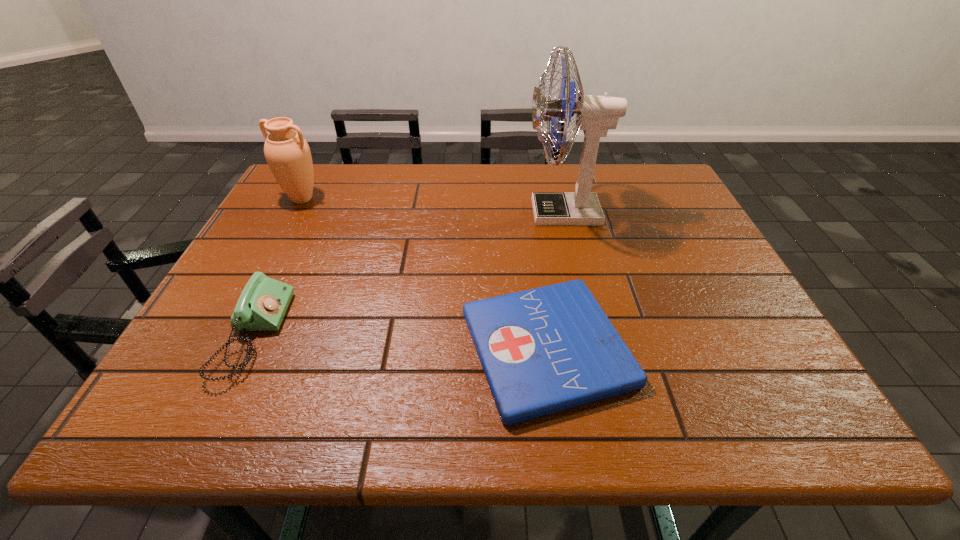
Find the location of a particular element. The image size is (960, 540). vacant space that satisfies the following two spatial constraints: 1. on the front side of the first-aid kit; 2. on the left side of the second tallest object is located at coordinates (223, 348).

Where is `vacant space that satisfies the following two spatial constraints: 1. on the dial of the telephone; 2. on the right side of the shortest object`? The width and height of the screenshot is (960, 540). vacant space that satisfies the following two spatial constraints: 1. on the dial of the telephone; 2. on the right side of the shortest object is located at coordinates coord(248,348).